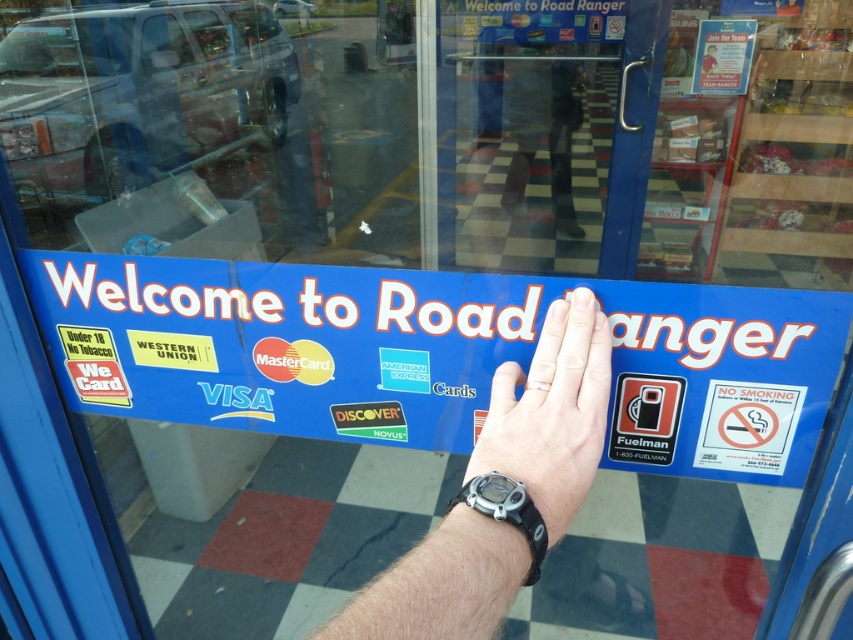
Question: Does blue plastic sign at center appear under black rubber watch at center?

Choices:
 (A) yes
 (B) no

Answer: (B)

Question: Does black rubber watch at center have a lesser width compared to black rubber watch at lower center?

Choices:
 (A) no
 (B) yes

Answer: (A)

Question: Can you confirm if blue plastic sign at center is positioned above black rubber wristband at center?

Choices:
 (A) no
 (B) yes

Answer: (B)

Question: Which of the following is the farthest from the observer?

Choices:
 (A) tap(544, 436)
 (B) tap(387, 627)
 (C) tap(798, 387)

Answer: (C)

Question: Which is nearer to the black rubber watch at center?

Choices:
 (A) blue plastic sign at center
 (B) black rubber wristband at center

Answer: (B)

Question: Which point is farther to the camera?

Choices:
 (A) blue plastic sign at center
 (B) black rubber watch at lower center

Answer: (A)